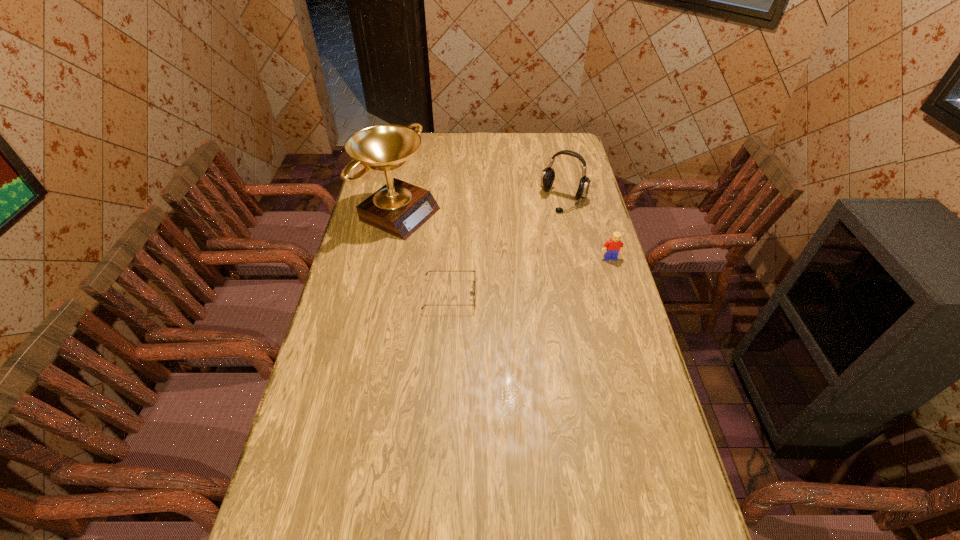
At what (x,y) coordinates should I click in order to perform the action: click on vacant space on the desktop that is between the nearest object and the second shortest object and is positioned with the microphone on the side of the headset. Please return your answer as a coordinate pair (x, y). Looking at the image, I should click on (517, 280).

The height and width of the screenshot is (540, 960). I want to click on vacant spot on the desktop that is between the sunglasses and the third tallest object and is positioned on the front-facing side of the award, so click(550, 272).